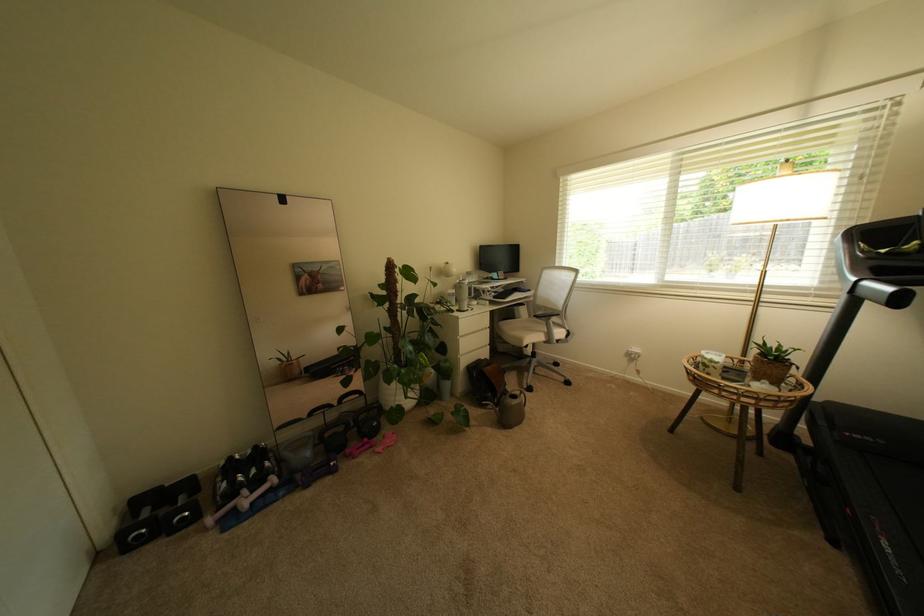
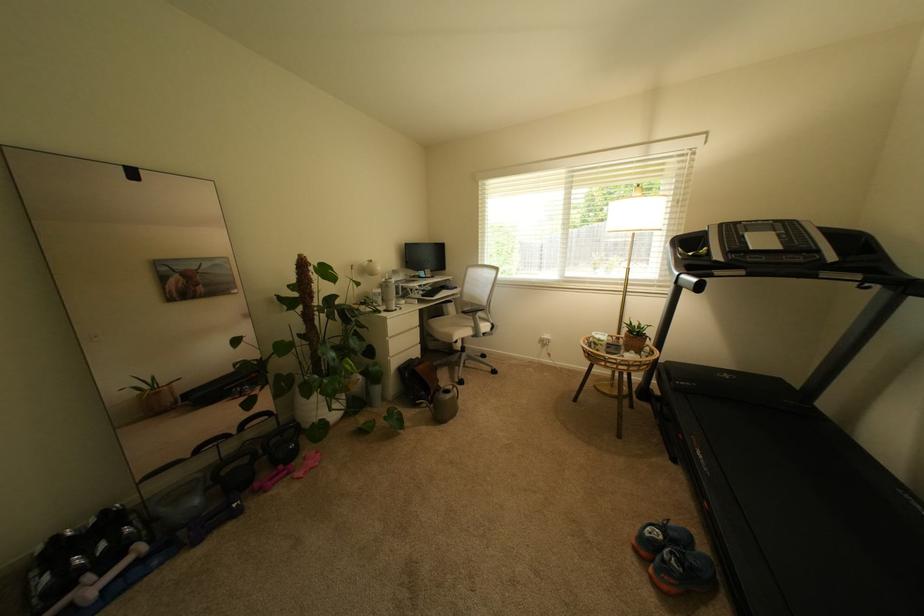
Locate, in the second image, the point that corresponds to pixel 538 318 in the first image.

(466, 314)